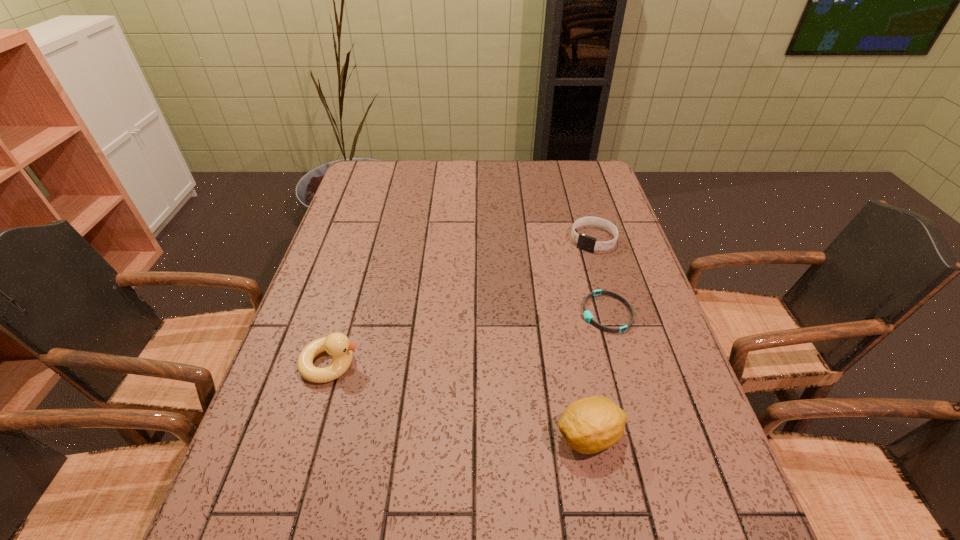
Find the location of a particular element. free space between the shortest object and the farthest object is located at coordinates (600, 276).

The height and width of the screenshot is (540, 960). I want to click on free space between the nearest object and the leftmost object, so click(x=460, y=400).

I want to click on free space between the nearest object and the second shortest object, so click(591, 338).

Locate an element on the screen. This screenshot has height=540, width=960. vacant area that lies between the duckling and the nearest object is located at coordinates (460, 400).

Point out which object is positioned as the third nearest to the leftmost object. Please provide its 2D coordinates. Your answer should be formatted as a tuple, i.e. [(x, y)], where the tuple contains the x and y coordinates of a point satisfying the conditions above.

[(584, 242)]

Locate which object ranks second in proximity to the nearest object. Please provide its 2D coordinates. Your answer should be formatted as a tuple, i.e. [(x, y)], where the tuple contains the x and y coordinates of a point satisfying the conditions above.

[(337, 345)]

Locate an element on the screen. free spot that satisfies the following two spatial constraints: 1. on the back side of the shortest object; 2. on the left side of the farthest object is located at coordinates (586, 239).